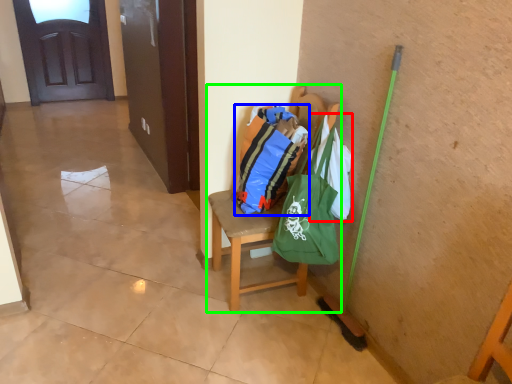
Question: Based on their relative distances, which object is farther from grocery bag (highlighted by a red box)? Choose from shopping bag (highlighted by a blue box) and chair (highlighted by a green box).

Choices:
 (A) shopping bag
 (B) chair

Answer: (B)